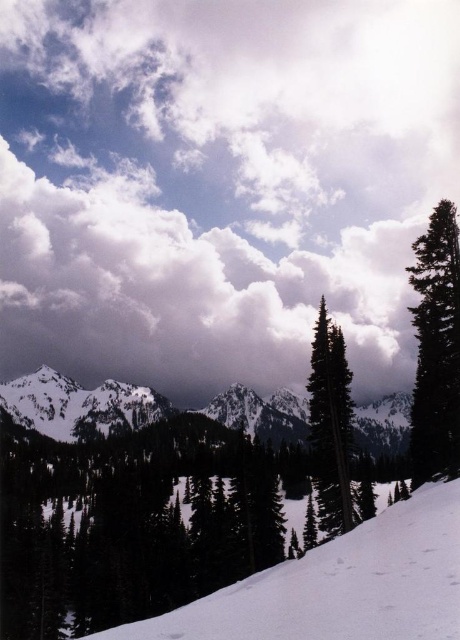
You are standing at the base of the snow slope and want to reach the point marked as point [431,225]. However, there is an obstacle at point [182,616]. Which point is closer to you, and should you adjust your path to avoid the obstacle?

Point [182,616] is closer to you than point [431,225]. Since the obstacle is at the closer point, you should adjust your path to go around it to reach your destination safely.

You are standing at the center of the image and want to walk towards the green matte tree at right. In which direction should you move?

Since the green matte tree at right is located at coordinates approximately 0.544 on the x axis and 0.948 on the y axis, you should move towards the upper right direction from the center to reach it.